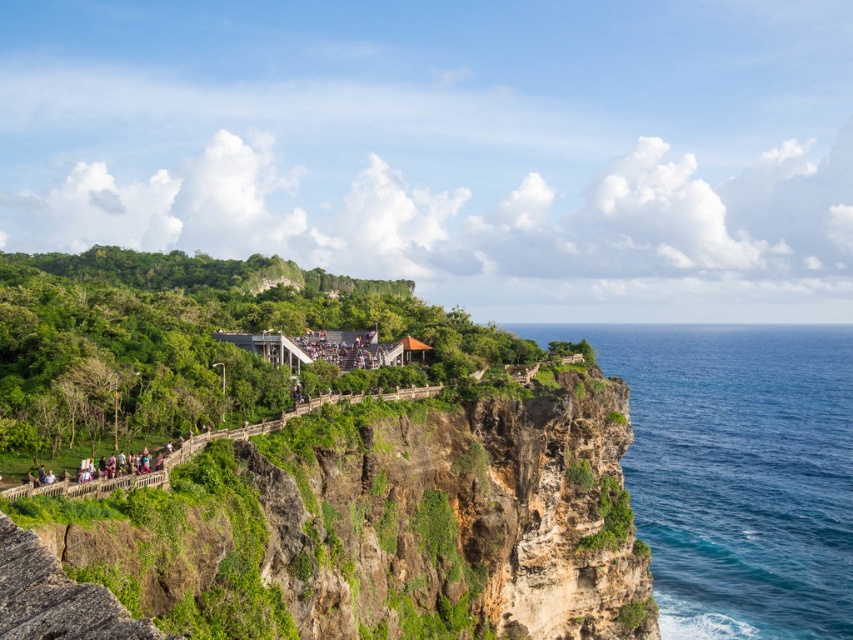
You are a hiker standing on the cliffside pathway. You notice the green leafy hillside at center and the blue smooth water at right. Which of these two landmarks is taller from your vantage point?

The green leafy hillside at center is not as tall as the blue smooth water at right, so the blue smooth water at right is taller from your vantage point.

You are standing at the starting point of the cliffside pathway and want to reach the green leafy hillside at center. Which direction should you walk along the cliff edge to reach it?

The green leafy hillside at center is located at coordinate point (357, 524), so you should walk towards the direction of increasing x and y coordinates along the cliff edge to reach it.